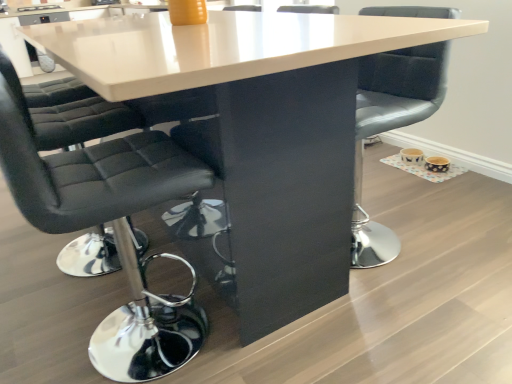
Image resolution: width=512 pixels, height=384 pixels. What are the coordinates of `free space that is to the left of black leather chair at left, positioned as the 2th chair in right-to-left order` in the screenshot? It's located at (42, 318).